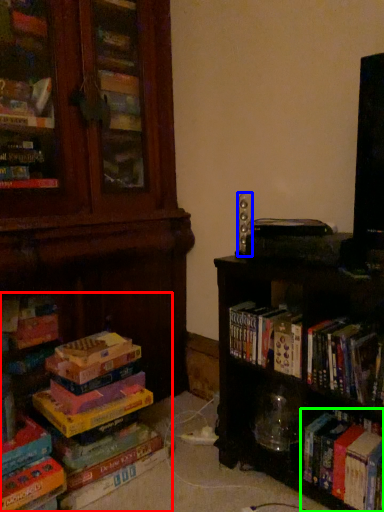
Question: Considering the real-world distances, which object is farthest from book (highlighted by a red box)? speaker (highlighted by a blue box) or book (highlighted by a green box)?

Choices:
 (A) speaker
 (B) book

Answer: (A)